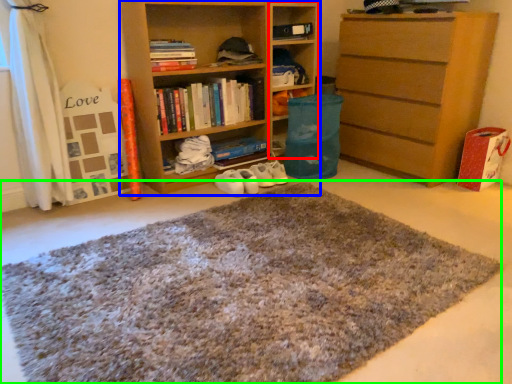
Question: Estimate the real-world distances between objects in this image. Which object is closer to cabinet (highlighted by a red box), shelf (highlighted by a blue box) or doormat (highlighted by a green box)?

Choices:
 (A) shelf
 (B) doormat

Answer: (A)